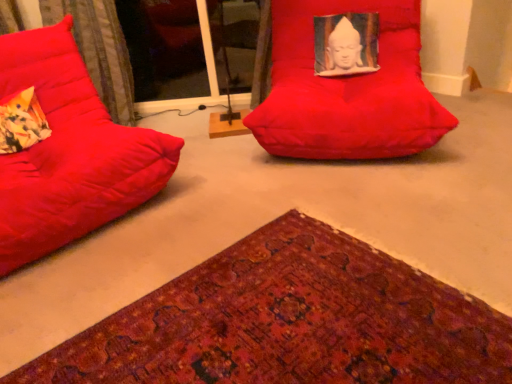
What do you see at coordinates (290, 322) in the screenshot? This screenshot has width=512, height=384. I see `textured woolen mat at lower left` at bounding box center [290, 322].

Image resolution: width=512 pixels, height=384 pixels. In order to click on textured woolen mat at lower left in this screenshot , I will do `click(290, 322)`.

Where is `matte red beanbag at center, which is the 1th furniture from right to left`? matte red beanbag at center, which is the 1th furniture from right to left is located at coordinates (348, 89).

This screenshot has width=512, height=384. Describe the element at coordinates (164, 48) in the screenshot. I see `transparent glass door at upper center` at that location.

Image resolution: width=512 pixels, height=384 pixels. Find the location of `matte red bean bag at left, which ranks as the first furniture in left-to-right order`. matte red bean bag at left, which ranks as the first furniture in left-to-right order is located at coordinates (69, 152).

The height and width of the screenshot is (384, 512). What are the coordinates of `textured woolen mat at lower left` in the screenshot? It's located at (290, 322).

Does matte red bean bag at left, the 2th furniture when ordered from right to left, appear on the right side of velvet-like fabric at left?

Yes, matte red bean bag at left, the 2th furniture when ordered from right to left, is to the right of velvet-like fabric at left.

Is velvet-like fabric at left surrounded by matte red bean bag at left, which ranks as the first furniture in left-to-right order?

No, velvet-like fabric at left is not inside matte red bean bag at left, which ranks as the first furniture in left-to-right order.

How many degrees apart are the facing directions of matte red bean bag at left, which ranks as the first furniture in left-to-right order, and velvet-like fabric at left?

The facing directions of matte red bean bag at left, which ranks as the first furniture in left-to-right order, and velvet-like fabric at left are 41.1 degrees apart.

The width and height of the screenshot is (512, 384). Identify the location of curtain above the textured woolen mat at lower left (from the image's perspective). (100, 51).

From the image's perspective, who appears lower, textured woolen mat at lower left or velvet-like fabric at left?

From the image's view, textured woolen mat at lower left is below.

In the image, is textured woolen mat at lower left positioned in front of or behind velvet-like fabric at left?

In the image, textured woolen mat at lower left appears in front of velvet-like fabric at left.

Considering the sizes of textured woolen mat at lower left and velvet-like fabric at left in the image, is textured woolen mat at lower left bigger or smaller than velvet-like fabric at left?

Considering their sizes, textured woolen mat at lower left takes up less space than velvet-like fabric at left.

Does point (160, 373) lie in front of point (376, 118)?

Yes.

Looking at the image, does textured woolen mat at lower left seem bigger or smaller compared to matte red beanbag at center, which is the 1th furniture from right to left?

textured woolen mat at lower left is smaller than matte red beanbag at center, which is the 1th furniture from right to left.

Locate an element on the screen. This screenshot has height=384, width=512. the 2nd furniture above the textured woolen mat at lower left (from a real-world perspective) is located at coordinates (348, 89).

Is textured woolen mat at lower left taller than matte red beanbag at center, which is the 1th furniture from right to left?

In fact, textured woolen mat at lower left may be shorter than matte red beanbag at center, which is the 1th furniture from right to left.

Is matte red beanbag at center, positioned as the 2th furniture in left-to-right order, placed right next to velvet-like fabric at left?

There is a gap between matte red beanbag at center, positioned as the 2th furniture in left-to-right order, and velvet-like fabric at left.

Where is `the 1st furniture in front of the velvet-like fabric at left, counting from the anchor's position`? The height and width of the screenshot is (384, 512). the 1st furniture in front of the velvet-like fabric at left, counting from the anchor's position is located at coordinates (348, 89).

Which is in front, point (413, 148) or point (3, 11)?

Positioned in front is point (413, 148).

Could transparent glass door at upper center be considered to be inside floral fabric pillow at left?

No.

From a real-world perspective, which object rests below the other?

transparent glass door at upper center, from a real-world perspective.

Is floral fabric pillow at left in front of or behind transparent glass door at upper center in the image?

floral fabric pillow at left is positioned closer to the viewer than transparent glass door at upper center.

From a real-world perspective, which is physically below, velvet-like fabric at left or floral fabric pillow at left?

In real-world perspective, floral fabric pillow at left is lower.

How distant is velvet-like fabric at left from floral fabric pillow at left?

A distance of 71.62 centimeters exists between velvet-like fabric at left and floral fabric pillow at left.

Is point (126, 79) closer or farther from the camera than point (40, 112)?

Point (126, 79) is positioned farther from the camera compared to point (40, 112).

Considering the sizes of objects velvet-like fabric at left and floral fabric pillow at left in the image provided, who is taller, velvet-like fabric at left or floral fabric pillow at left?

velvet-like fabric at left is taller.

From a real-world perspective, is matte red bean bag at left, the 2th furniture when ordered from right to left, physically located above or below textured woolen mat at lower left?

In terms of real-world spatial position, matte red bean bag at left, the 2th furniture when ordered from right to left, is above textured woolen mat at lower left.

From the image's perspective, is matte red bean bag at left, the 2th furniture when ordered from right to left, over textured woolen mat at lower left?

Yes.

Is matte red bean bag at left, which ranks as the first furniture in left-to-right order, facing away from textured woolen mat at lower left?

matte red bean bag at left, which ranks as the first furniture in left-to-right order, does not have its back to textured woolen mat at lower left.

In the image, is matte red bean bag at left, the 2th furniture when ordered from right to left, positioned in front of or behind textured woolen mat at lower left?

matte red bean bag at left, the 2th furniture when ordered from right to left, is positioned farther from the viewer than textured woolen mat at lower left.

From a real-world perspective, which furniture is the 2nd one underneath the velvet-like fabric at left? Please provide its 2D coordinates.

[(69, 152)]

Identify the location of curtain on the left side of textured woolen mat at lower left. The width and height of the screenshot is (512, 384). (100, 51).

Looking at the image, which one is located further to transparent glass door at upper center, matte red beanbag at center, positioned as the 2th furniture in left-to-right order, or textured woolen mat at lower left?

Based on the image, textured woolen mat at lower left appears to be further to transparent glass door at upper center.

From the image, which object appears to be farther from transparent glass door at upper center, matte red bean bag at left, the 2th furniture when ordered from right to left, or textured woolen mat at lower left?

Based on the image, textured woolen mat at lower left appears to be further to transparent glass door at upper center.

When comparing their distances from matte red beanbag at center, positioned as the 2th furniture in left-to-right order, does velvet-like fabric at left or floral fabric pillow at left seem further?

floral fabric pillow at left is positioned further to the anchor matte red beanbag at center, positioned as the 2th furniture in left-to-right order.

Which object lies nearer to the anchor point textured woolen mat at lower left, floral fabric pillow at left or velvet-like fabric at left?

floral fabric pillow at left is closer to textured woolen mat at lower left.

Estimate the real-world distances between objects in this image. Which object is further from textured woolen mat at lower left, transparent glass door at upper center or velvet-like fabric at left?

The object further to textured woolen mat at lower left is transparent glass door at upper center.

From the image, which object appears to be nearer to velvet-like fabric at left, matte red beanbag at center, positioned as the 2th furniture in left-to-right order, or textured woolen mat at lower left?

Based on the image, matte red beanbag at center, positioned as the 2th furniture in left-to-right order, appears to be nearer to velvet-like fabric at left.

When comparing their distances from textured woolen mat at lower left, does floral fabric pillow at left or transparent glass door at upper center seem closer?

floral fabric pillow at left is closer to textured woolen mat at lower left.

Which object lies nearer to the anchor point matte red bean bag at left, the 2th furniture when ordered from right to left, velvet-like fabric at left or matte red beanbag at center, positioned as the 2th furniture in left-to-right order?

velvet-like fabric at left.

At what (x,y) coordinates should I click in order to perform the action: click on throw pillow positioned between textured woolen mat at lower left and velvet-like fabric at left from near to far. Please return your answer as a coordinate pair (x, y). This screenshot has height=384, width=512. Looking at the image, I should click on (22, 122).

Locate an element on the screen. The image size is (512, 384). curtain between textured woolen mat at lower left and transparent glass door at upper center along the z-axis is located at coordinates (100, 51).

Image resolution: width=512 pixels, height=384 pixels. I want to click on mat between matte red bean bag at left, the 2th furniture when ordered from right to left, and matte red beanbag at center, positioned as the 2th furniture in left-to-right order, in the horizontal direction, so click(x=290, y=322).

Locate an element on the screen. The image size is (512, 384). furniture between velvet-like fabric at left and matte red beanbag at center, which is the 1th furniture from right to left is located at coordinates (69, 152).